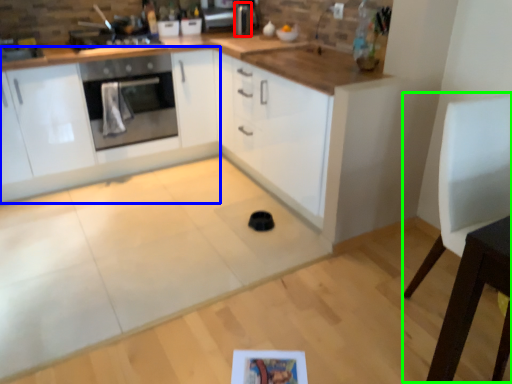
Question: Estimate the real-world distances between objects in this image. Which object is closer to appliance (highlighted by a red box), cabinetry (highlighted by a blue box) or chair (highlighted by a green box)?

Choices:
 (A) cabinetry
 (B) chair

Answer: (A)